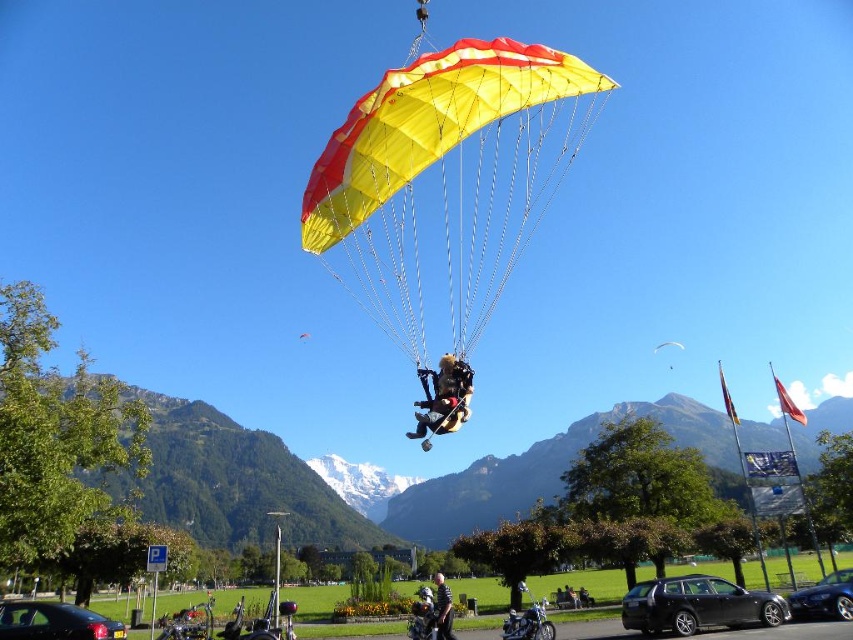
Can you confirm if shiny blue car at lower right is smaller than shiny chrome motorcycle at center?

Yes, shiny blue car at lower right is smaller than shiny chrome motorcycle at center.

Identify the location of shiny blue car at lower right. The width and height of the screenshot is (853, 640). (822, 598).

This screenshot has height=640, width=853. Identify the location of matte black station wagon at lower right. (697, 605).

Which is behind, point (450, 605) or point (666, 340)?

Point (666, 340)

Which is in front, point (434, 611) or point (666, 342)?

Point (434, 611) is more forward.

Describe the element at coordinates (442, 609) in the screenshot. This screenshot has width=853, height=640. I see `dark gray leather jacket at lower center` at that location.

This screenshot has width=853, height=640. In order to click on dark gray leather jacket at lower center in this screenshot , I will do `click(442, 609)`.